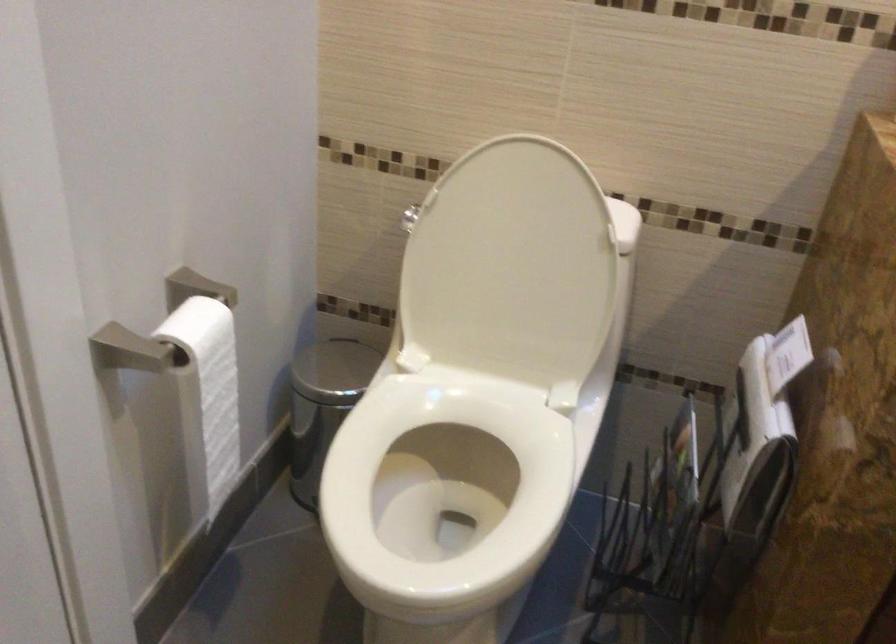
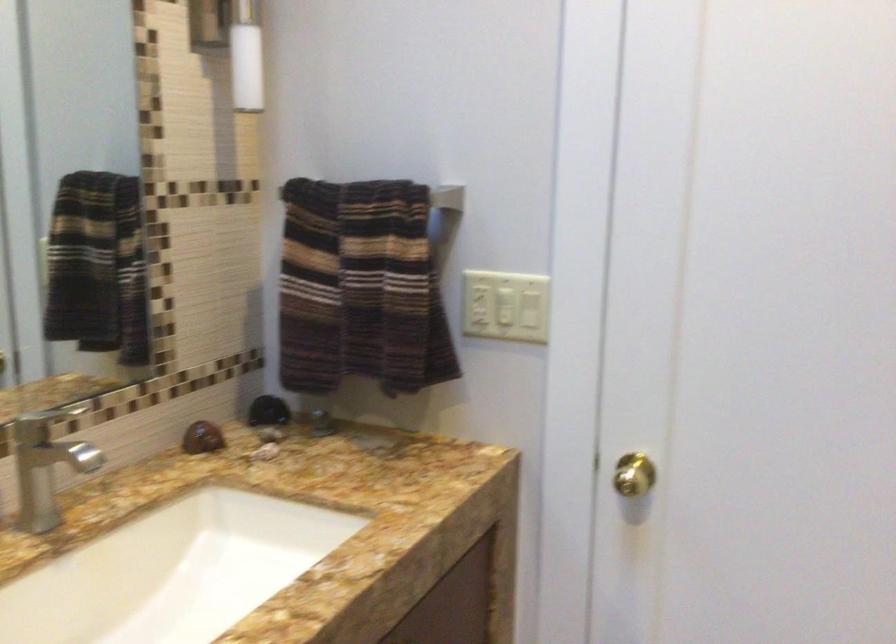
Question: Based on the continuous images, in which direction is the camera rotating? Reply with the corresponding letter.

Choices:
 (A) Left
 (B) Right
 (C) Up
 (D) Down

Answer: (B)